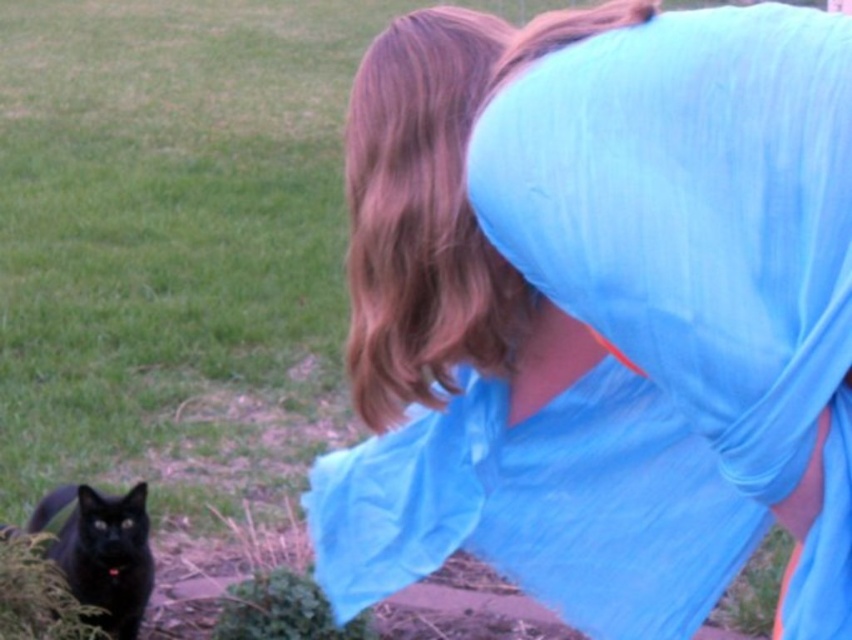
You are a photographer trying to capture a closeup of the shiny black cat at lower left. The blue fabric shirt at center is blocking your view. Can you estimate if the cat is shorter than the shirt so that you can adjust your camera angle accordingly?

The blue fabric shirt at center is taller than shiny black cat at lower left, so the cat is shorter than the shirt. To capture the cat without obstruction, you should lower your camera angle to avoid the shirt blocking the view.

You are a photographer trying to capture a clear shot of the shiny black cat at lower left without the blue fabric shirt at center blocking it. What adjustment should you make to your camera angle?

The blue fabric shirt at center is above the shiny black cat at lower left, so you should lower your camera angle to avoid the shirt blocking the cat.

The person in the image is wearing a blue fabric shirt at center. If the person wants to ensure their shirt stays clean while interacting with the black cat, should they move closer or farther away from the cat?

The person should move farther away from the black cat to keep their blue fabric shirt at center clean since they are currently 38.50 inches apart.